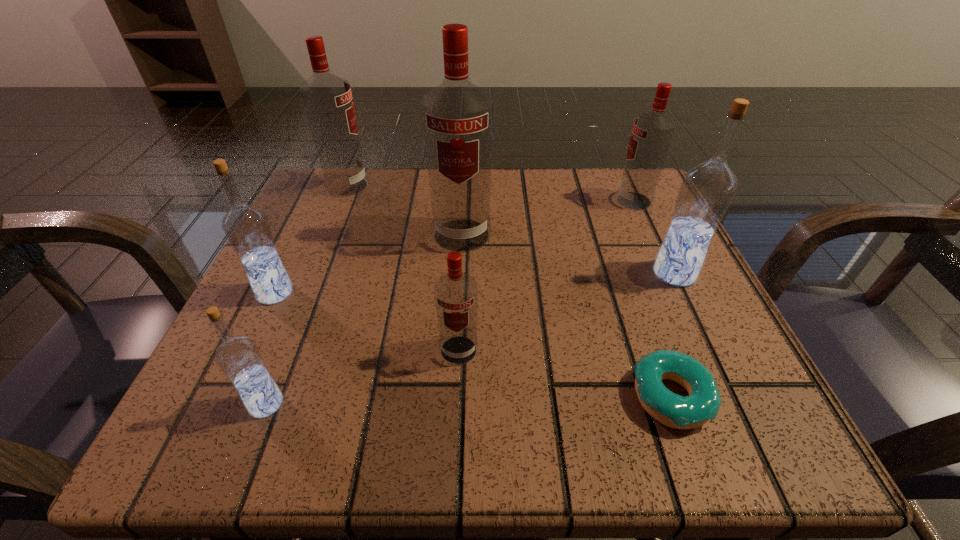
The image size is (960, 540). Identify the location of vacant space situated on the left of the doughnut. (473, 397).

Locate an element on the screen. vodka that is at the near edge is located at coordinates (238, 357).

The width and height of the screenshot is (960, 540). I want to click on doughnut present at the near edge, so click(703, 403).

You are a GUI agent. You are given a task and a screenshot of the screen. Output one action in this format:
    pyautogui.click(x=<x>, y=<y>)
    Task: Click on the doughnut that is at the right edge
    
    Given the screenshot: What is the action you would take?
    pyautogui.click(x=703, y=403)

The image size is (960, 540). What are the coordinates of `object at the far left corner` in the screenshot? It's located at tap(327, 99).

Locate an element on the screen. object that is positioned at the near left corner is located at coordinates (238, 357).

The image size is (960, 540). In order to click on object that is at the far right corner in this screenshot , I will do `click(652, 132)`.

Find the location of a particular element. object that is at the near right corner is located at coordinates (703, 403).

Find the location of `free space at the far edge of the desktop`. free space at the far edge of the desktop is located at coordinates (414, 170).

At what (x,y) coordinates should I click in order to perform the action: click on vacant region at the near edge of the desktop. Please return your answer as a coordinate pair (x, y). This screenshot has width=960, height=540. Looking at the image, I should click on (482, 414).